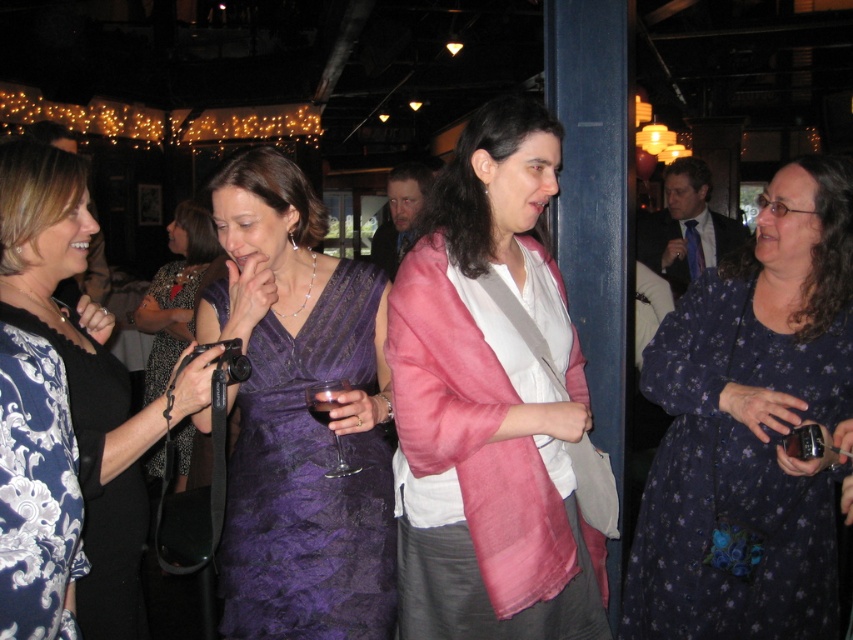
You are a photographer at the party and want to capture both the purple satin dress at center and the purple lace dress at center in your shot. Which dress will appear closer to the camera in the photo?

The purple satin dress at center will appear closer to the camera in the photo because it is in front of the purple lace dress at center.

You are a photographer at the event and want to capture both the pink silk jacket at center and the transparent glass at center in a single photo. Can you fit both items into the frame if your camera has a minimum focus distance of 30 centimeters?

The pink silk jacket at center and transparent glass at center are 35.36 centimeters apart from each other. Since the minimum focus distance is 30 centimeters, the camera can focus on both items as they are within the required distance.